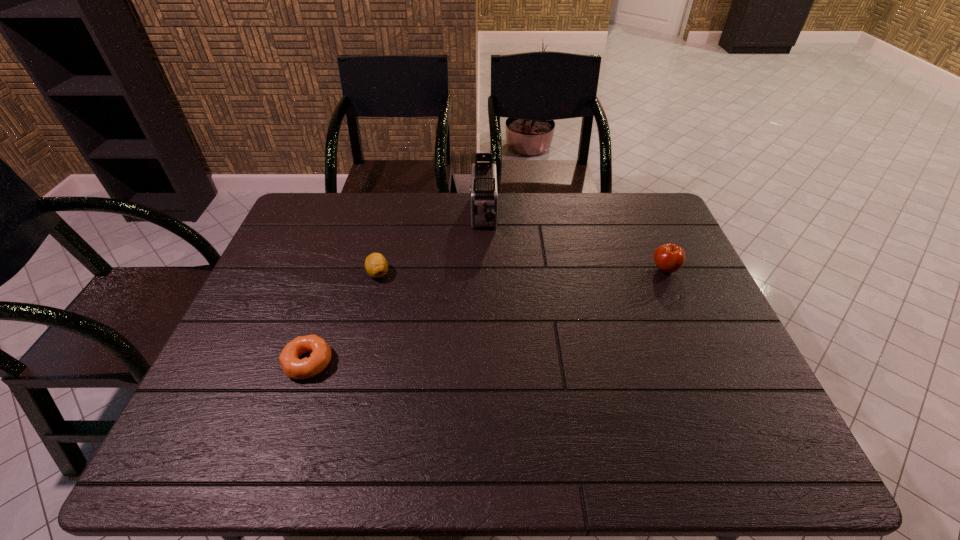
You are a GUI agent. You are given a task and a screenshot of the screen. Output one action in this format:
    pyautogui.click(x=<x>, y=<y>)
    Task: Click on the empty space that is in between the rightmost object and the camcorder
    Image resolution: width=960 pixels, height=540 pixels.
    Given the screenshot: What is the action you would take?
    pyautogui.click(x=574, y=242)

Where is `free spot between the leftmost object and the lemon`? Image resolution: width=960 pixels, height=540 pixels. free spot between the leftmost object and the lemon is located at coordinates (343, 318).

What are the coordinates of `free area in between the second shortest object and the doughnut` in the screenshot? It's located at (343, 318).

This screenshot has height=540, width=960. Identify the location of the second closest object to the third object from right to left. pyautogui.click(x=483, y=191).

At what (x,y) coordinates should I click in order to perform the action: click on object that is the second closest to the shortest object. Please return your answer as a coordinate pair (x, y). Looking at the image, I should click on (483, 191).